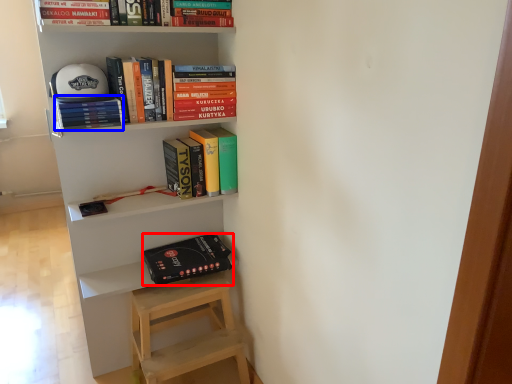
Question: Which of the following is the farthest to the observer, paperback book (highlighted by a red box) or book (highlighted by a blue box)?

Choices:
 (A) paperback book
 (B) book

Answer: (A)